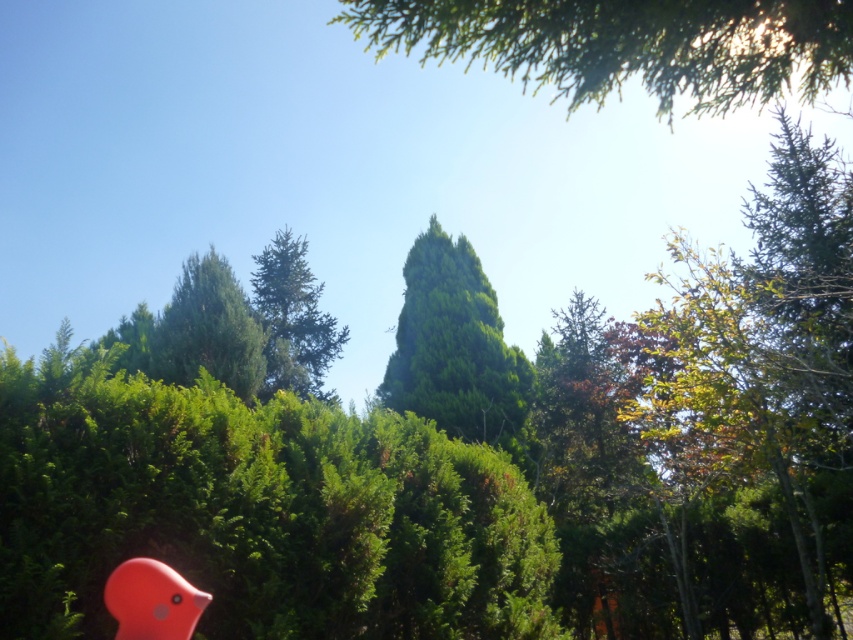
Question: Is green textured hedge at center wider than green textured tree at upper left?

Choices:
 (A) no
 (B) yes

Answer: (B)

Question: Which point is farther to the camera?

Choices:
 (A) [x=218, y=260]
 (B) [x=219, y=508]

Answer: (A)

Question: Which point is farther from the camera taking this photo?

Choices:
 (A) (502, 541)
 (B) (279, 232)

Answer: (B)

Question: Is green leafy tree at upper center smaller than green needle-like tree at center?

Choices:
 (A) yes
 (B) no

Answer: (B)

Question: From the image, what is the correct spatial relationship of green leafy tree at center in relation to green needle-like tree at center?

Choices:
 (A) below
 (B) above

Answer: (A)

Question: Which point is farther to the camera?

Choices:
 (A) green textured tree at upper left
 (B) green needle-like tree at center

Answer: (B)